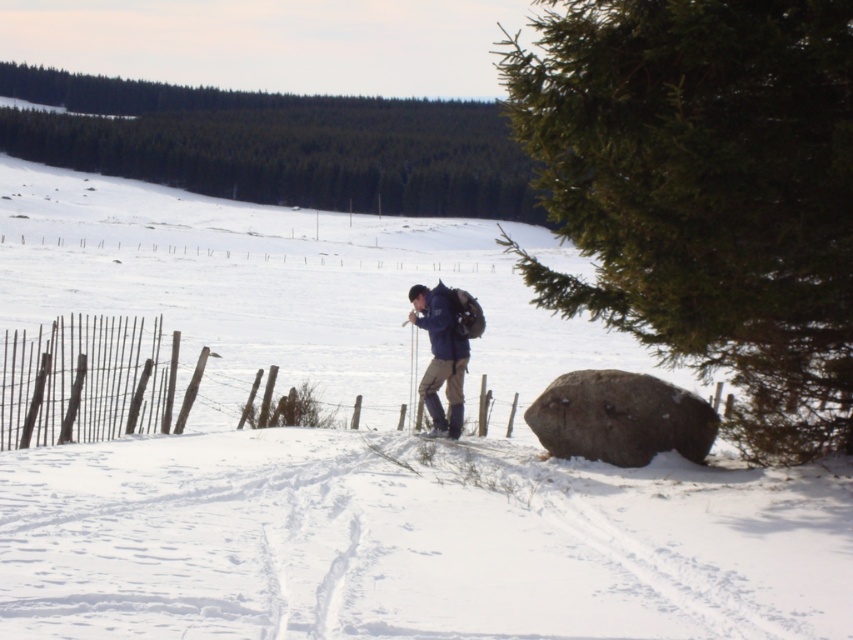
You are planning to build a snowman in the winter landscape shown. The snowman must be constructed using the white powdery snow at center. However, you need to ensure that the snowman is placed at least 2 meters away from the rusty wire fence at left. Based on the scene description, is this possible?

The white powdery snow at center is located below the rusty wire fence at left. Since the snow is below the fence, there is sufficient space between them to place the snowman at least 2 meters away from the fence.

You are standing at the starting point of a cross country skiing trail and see two points marked on the map. The first point is at coordinate point [202,116] and the second is at point [451,337]. Which point is closer to you?

Point [202,116] is closer to you because it is further to the viewer than point [451,337].

You are navigating a cross country ski trail and see the point marked at coordinates [410,541]. Based on the scene description, what terrain feature is located at that point?

The point at [410,541] is on white powdery snow at center.